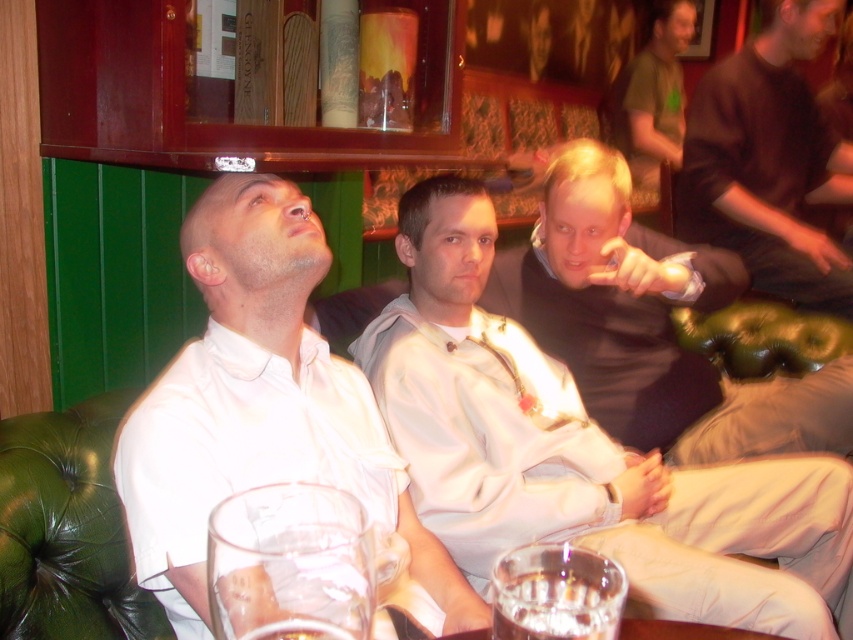
Is light beige hoodie at center above dark brown shirt at upper right?

No, light beige hoodie at center is not above dark brown shirt at upper right.

At what (x,y) coordinates should I click in order to perform the action: click on light beige hoodie at center. Please return your answer as a coordinate pair (x, y). This screenshot has height=640, width=853. Looking at the image, I should click on [579, 452].

Image resolution: width=853 pixels, height=640 pixels. Describe the element at coordinates (579, 452) in the screenshot. I see `light beige hoodie at center` at that location.

What are the coordinates of `light beige hoodie at center` in the screenshot? It's located at (579, 452).

Between light beige hoodie at center and translucent glass at lower center, which one is positioned higher?

light beige hoodie at center

Is light beige hoodie at center taller than translucent glass at lower center?

Yes, light beige hoodie at center is taller than translucent glass at lower center.

Is point (448, 525) less distant than point (527, 608)?

No, it is not.

The height and width of the screenshot is (640, 853). I want to click on light beige hoodie at center, so click(x=579, y=452).

Does white shirt at center appear on the right side of clear glass at lower center?

In fact, white shirt at center is to the left of clear glass at lower center.

Who is shorter, white shirt at center or clear glass at lower center?

clear glass at lower center is shorter.

Who is more forward, (264, 371) or (267, 630)?

Point (267, 630) is more forward.

Identify the location of white shirt at center. This screenshot has width=853, height=640. (263, 410).